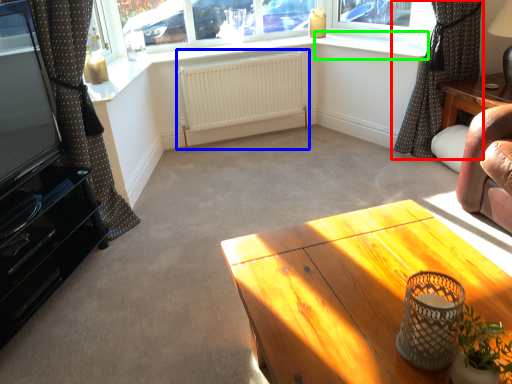
Question: Considering the real-world distances, which object is closest to curtain (highlighted by a red box)? radiator (highlighted by a blue box) or window sill (highlighted by a green box).

Choices:
 (A) radiator
 (B) window sill

Answer: (B)